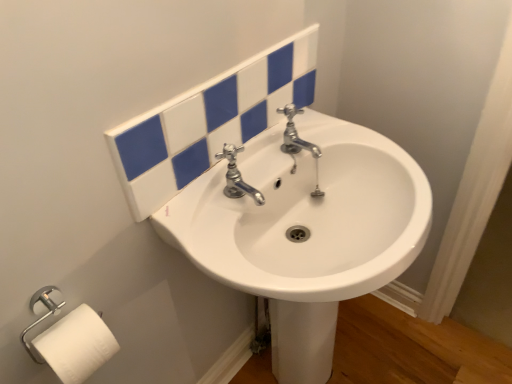
I want to click on free space behind polished chrome faucet at center, so click(265, 166).